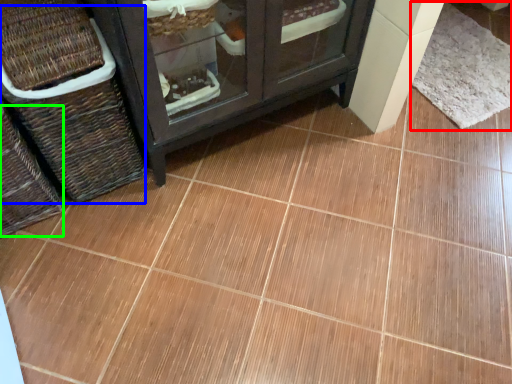
Question: Estimate the real-world distances between objects in this image. Which object is farther from mat (highlighted by a red box), basket (highlighted by a blue box) or basket (highlighted by a green box)?

Choices:
 (A) basket
 (B) basket

Answer: (B)